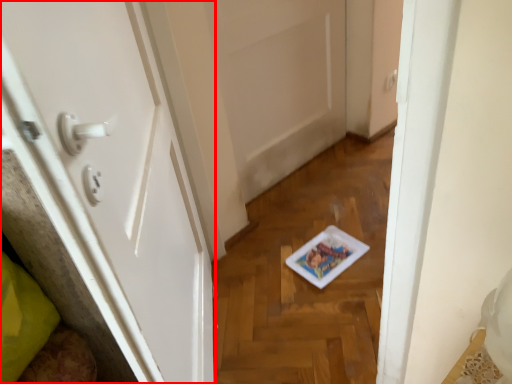
Question: From the image's perspective, where is door (annotated by the red box) located in relation to door in the image?

Choices:
 (A) below
 (B) above

Answer: (A)